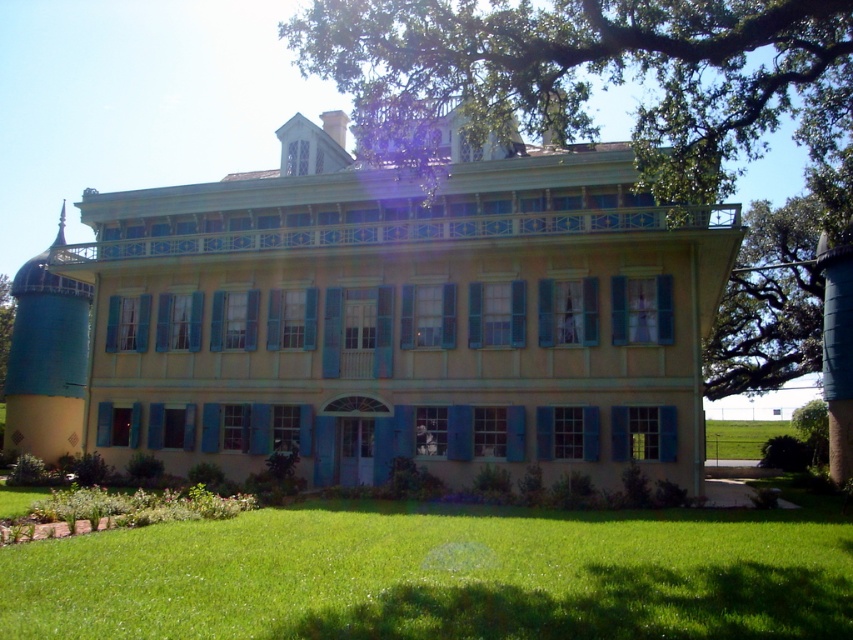
Does green grass at lower center have a greater width compared to green leafy tree at upper center?

No.

What are the coordinates of `green grass at lower center` in the screenshot? It's located at (439, 576).

Is green grass at lower center positioned in front of green grass at lower right?

Yes, green grass at lower center is in front of green grass at lower right.

How distant is green grass at lower center from green grass at lower right?

green grass at lower center is 98.59 feet from green grass at lower right.

Is point (445, 586) closer to viewer compared to point (747, 451)?

Yes, point (445, 586) is in front of point (747, 451).

Image resolution: width=853 pixels, height=640 pixels. In order to click on green grass at lower center in this screenshot , I will do `click(439, 576)`.

Can you confirm if green leafy tree at upper center is positioned above green leafy tree at lower left?

Yes, green leafy tree at upper center is above green leafy tree at lower left.

Is green leafy tree at upper center to the left of green leafy tree at lower left from the viewer's perspective?

In fact, green leafy tree at upper center is to the right of green leafy tree at lower left.

I want to click on green leafy tree at upper center, so click(x=601, y=77).

Identify the location of green leafy tree at upper center. (x=601, y=77).